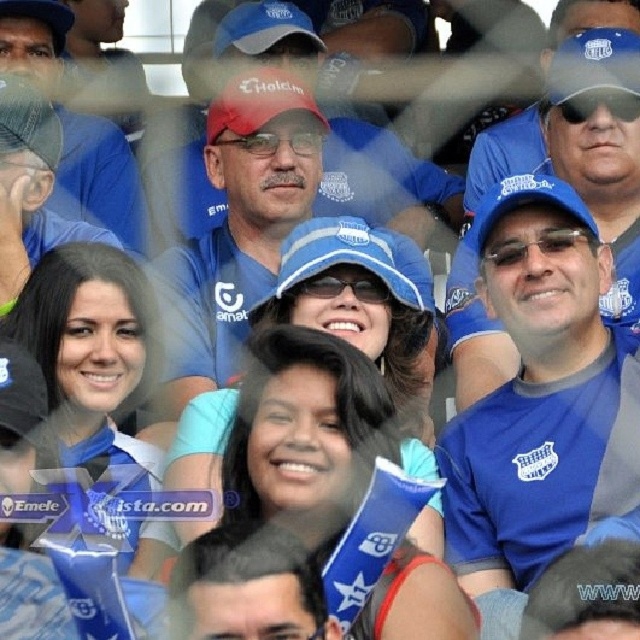
You are a photographer standing at the center of the stadium, and you want to take a photo of the blue fabric cap at upper center. Based on its 2D location coordinates, where should you aim your camera?

The blue fabric cap at upper center is located at coordinates point (602,176), so you should aim your camera slightly to the left and upwards to capture it.

You are a photographer at the event. You want to take a photo of the blue fabric shirt at center and the matte blue cap at upper center. Which object should you focus on first if you want to capture both in the same frame without moving the camera?

The blue fabric shirt at center is below the matte blue cap at upper center, so you should focus on the matte blue cap at upper center first since it is higher up in the frame.